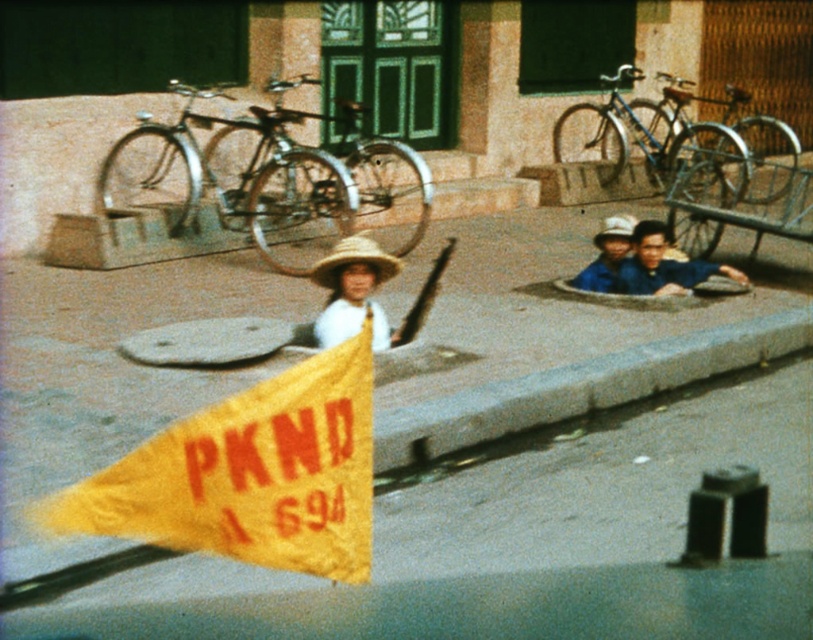
You are a photographer standing at the edge of the street scene. You want to take a photo that includes both the gray concrete curb at lower center and the matte blue shirt at lower right. Based on their positions, which object should you focus on first to ensure both are in sharp focus?

The gray concrete curb at lower center is closer to the viewer than the matte blue shirt at lower right. To ensure both are in sharp focus, you should focus on the gray concrete curb at lower center first since it is the closer object.

Based on the photo, you are a delivery person trying to navigate through the street scene. There is a gray concrete curb at lower center represented by point [581,387]. Can you safely pass through this point without hitting the curb?

The gray concrete curb at lower center is exactly at point [581,387], so passing through this point would mean driving directly onto the curb, which is not safe. You should adjust your route to avoid this point.

You are a photographer trying to capture the matte blue shirt at lower right without the yellow fabric flag at center blocking the view. Can you move to a position where the flag is out of the frame?

The yellow fabric flag at center is in front of the matte blue shirt at lower right, so moving the camera position might allow you to exclude the flag from the frame by shifting focus to the area behind it where the matte blue shirt at lower right is located.